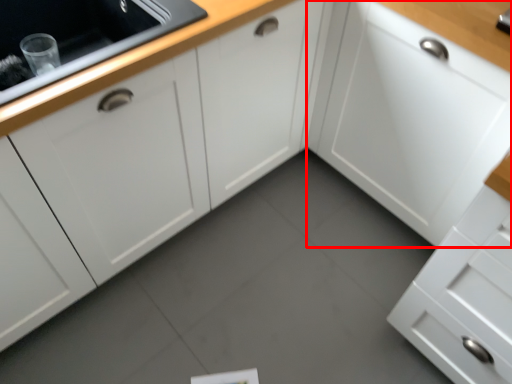
Question: Observing the image, what is the correct spatial positioning of cabinetry (annotated by the red box) in reference to cabinetry?

Choices:
 (A) right
 (B) left

Answer: (A)